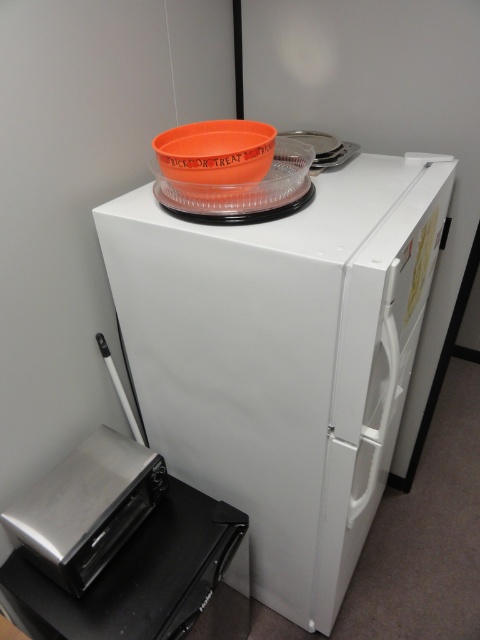
You are standing in the kitchen and want to place a snack on the white matte refrigerator at upper center and orange matte bowl at upper center. Which object is closer to you where you can easily reach it?

The white matte refrigerator at upper center is closer to the viewer than the orange matte bowl at upper center, so you can easily reach it.

You are trying to place a new spice rack that is 1.2 meters wide between the white matte refrigerator at upper center and the orange matte bowl at upper center. Based on their widths, will there be enough space for the spice rack?

The white matte refrigerator at upper center might be wider than orange matte bowl at upper center, so it is uncertain whether the spice rack will fit without knowing the exact widths of both objects.